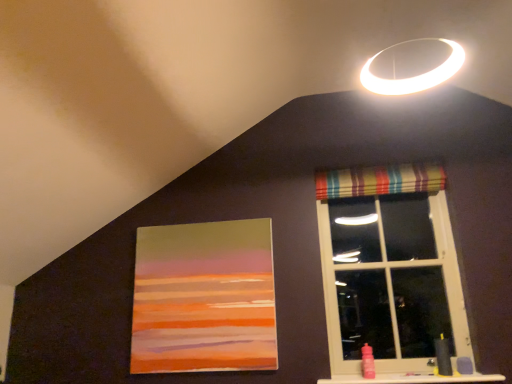
Question: Is striped fabric curtain at upper right in front of or behind striped fabric window at upper right in the image?

Choices:
 (A) front
 (B) behind

Answer: (B)

Question: Considering the positions of striped fabric curtain at upper right and striped fabric window at upper right in the image, is striped fabric curtain at upper right bigger or smaller than striped fabric window at upper right?

Choices:
 (A) small
 (B) big

Answer: (A)

Question: Which object is positioned closest to the smooth plastic bottle at lower right?

Choices:
 (A) matte acrylic painting at center
 (B) striped fabric window at upper right
 (C) yellow rubber sink at lower right
 (D) striped fabric curtain at upper right

Answer: (C)

Question: Which object is positioned closest to the yellow rubber sink at lower right?

Choices:
 (A) striped fabric window at upper right
 (B) matte acrylic painting at center
 (C) striped fabric curtain at upper right
 (D) smooth plastic bottle at lower right

Answer: (D)